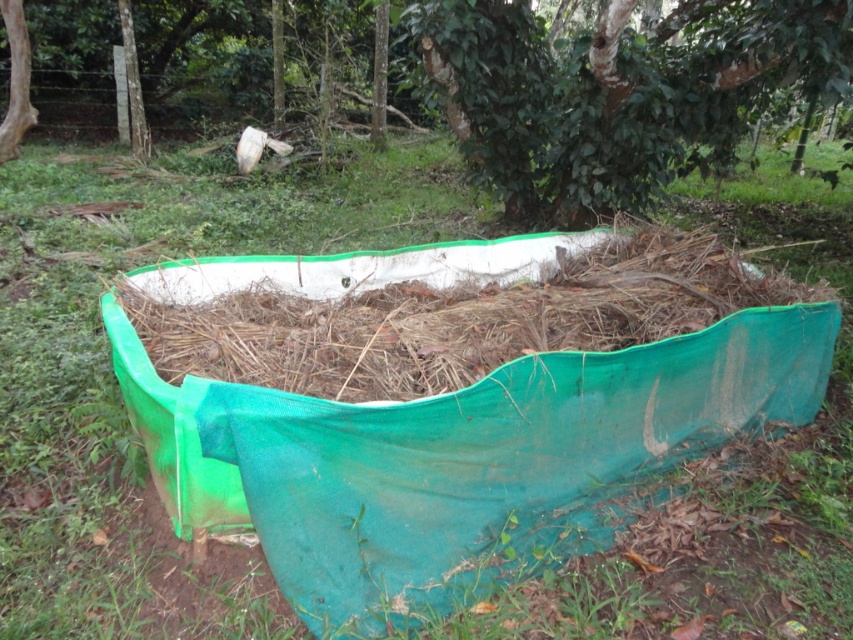
You are a hiker who wants to take shelter under the green leafy tree at upper center. Can you stand directly under the tree while also staying clear of the green fabric hay at center?

The green leafy tree at upper center is above the green fabric hay at center, so standing directly under the tree would mean you are also above the green fabric hay at center. Therefore, you cannot stand directly under the tree while staying clear of the green fabric hay at center.

You are standing in front of the container covered by the green tarp. There are two points marked on the tarp, one at coordinates point (583, 212) and the other at point (349, 280). Which point is closer to you?

Point (349, 280) is closer to you because it is less further to the viewer than point (583, 212).

You are a landscape designer planning to place a new bench in this outdoor area. You want the bench to be positioned where it can be seen from both the green leafy tree at upper center and the green fabric hay at center. Given their sizes, which object will make the bench more visible from its location?

The green leafy tree at upper center is larger in size compared to the green fabric hay at center. Therefore, positioning the bench near the green leafy tree at upper center will provide a better vantage point for visibility from both locations.